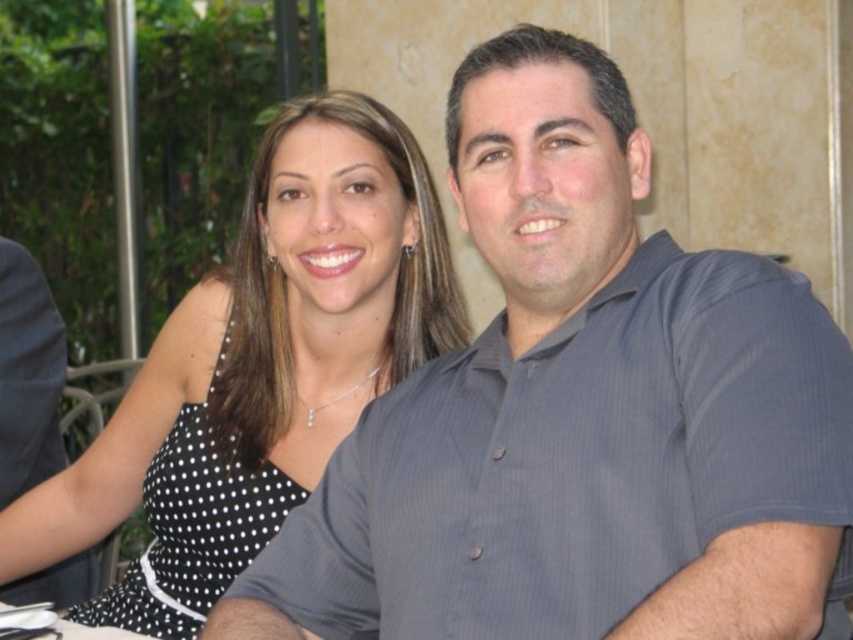
Question: From the image, what is the correct spatial relationship of gray striped shirt at center in relation to black dotted dress at center?

Choices:
 (A) above
 (B) below

Answer: (A)

Question: Can you confirm if gray striped shirt at center is positioned above black dotted dress at center?

Choices:
 (A) yes
 (B) no

Answer: (A)

Question: Which point is farther to the camera?

Choices:
 (A) gray striped shirt at center
 (B) black dotted dress at center

Answer: (B)

Question: Can you confirm if gray striped shirt at center is thinner than black dotted dress at center?

Choices:
 (A) no
 (B) yes

Answer: (B)